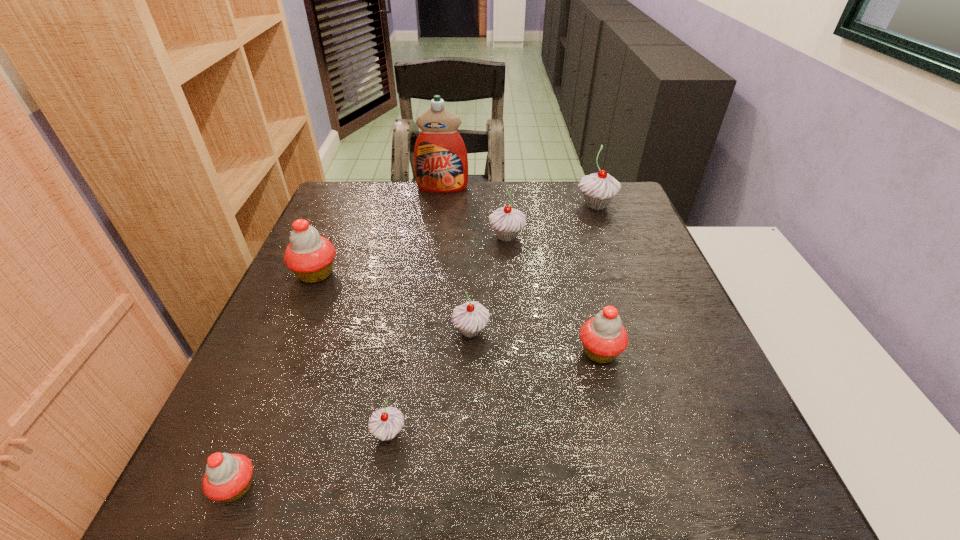
You are a GUI agent. You are given a task and a screenshot of the screen. Output one action in this format:
    pyautogui.click(x=<x>, y=<y>)
    Task: Click on the unoccupied area between the farthest cupcake and the third nearest gray cupcake
    
    Given the screenshot: What is the action you would take?
    pyautogui.click(x=551, y=221)

Locate an element on the screen. Image resolution: width=960 pixels, height=540 pixels. free space between the detergent and the biggest gray cupcake is located at coordinates [519, 197].

Where is `empty space between the second biggest red cupcake and the red detergent`? empty space between the second biggest red cupcake and the red detergent is located at coordinates (521, 270).

Where is `free space between the second nearest cupcake and the tallest object`? The width and height of the screenshot is (960, 540). free space between the second nearest cupcake and the tallest object is located at coordinates (416, 310).

Locate an element on the screen. empty space that is in between the seventh nearest object and the fifth nearest cupcake is located at coordinates (456, 240).

Identify which object is the fourth nearest to the biggest red cupcake. Please provide its 2D coordinates. Your answer should be formatted as a tuple, i.e. [(x, y)], where the tuple contains the x and y coordinates of a point satisfying the conditions above.

[(507, 222)]

Identify the location of object that is the sixth closest to the farthest object. (385, 423).

Image resolution: width=960 pixels, height=540 pixels. I want to click on cupcake object that ranks as the second closest to the red detergent, so click(598, 189).

The image size is (960, 540). What are the coordinates of `the fifth closest cupcake to the farthest red cupcake` in the screenshot? It's located at (604, 337).

Choose which gray cupcake is the second nearest neighbor to the farthest gray cupcake. Please provide its 2D coordinates. Your answer should be formatted as a tuple, i.e. [(x, y)], where the tuple contains the x and y coordinates of a point satisfying the conditions above.

[(470, 318)]